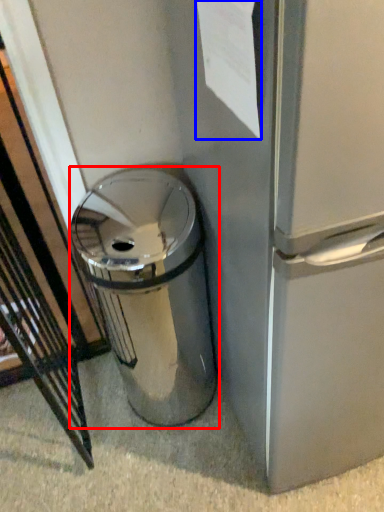
Question: Which of the following is the closest to the observer, waste container (highlighted by a red box) or paper (highlighted by a blue box)?

Choices:
 (A) waste container
 (B) paper

Answer: (B)